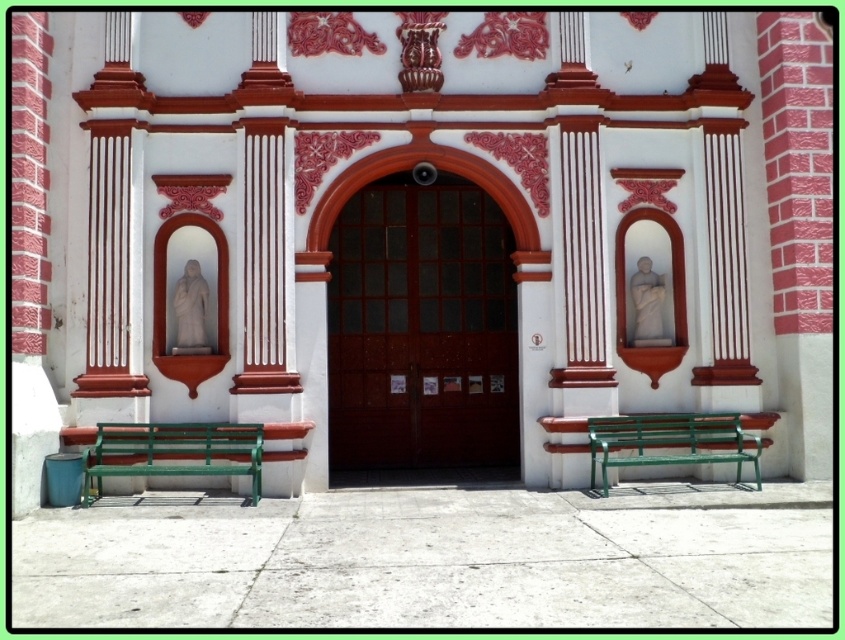
You are standing at the entrance of the building and want to determine the relative positions of two points marked in the image. Which point is nearer to you, point (104, 474) or point (754, 476)?

Point (104, 474) is closer to the viewer than point (754, 476).